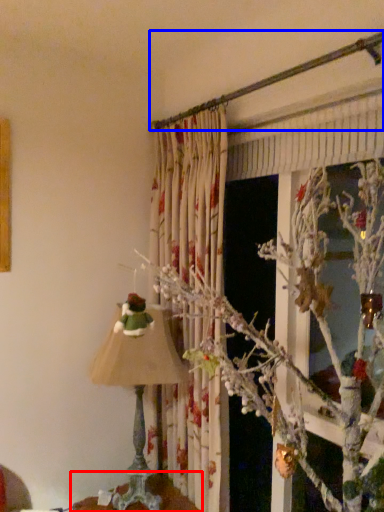
Question: Which point is further to the camera, furniture (highlighted by a red box) or branch (highlighted by a blue box)?

Choices:
 (A) furniture
 (B) branch

Answer: (A)